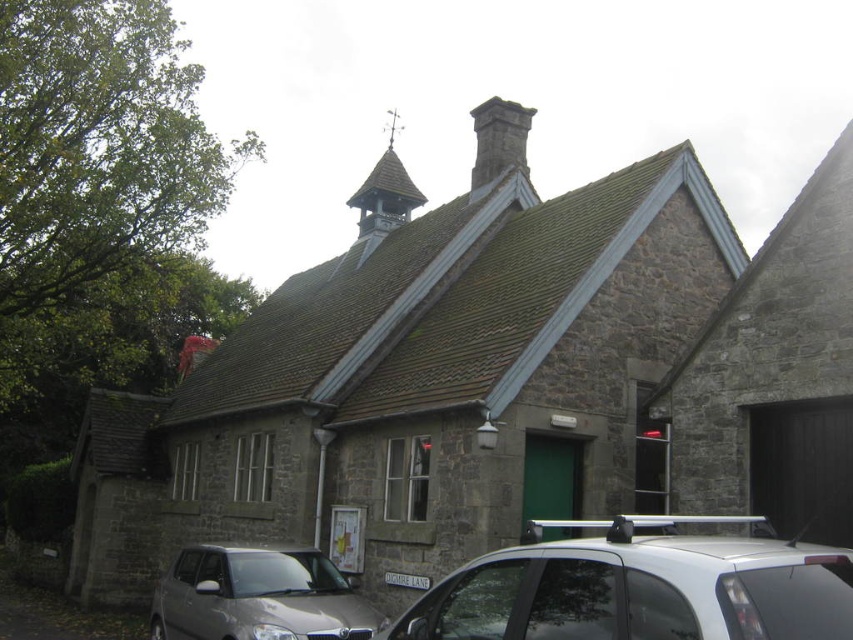
Question: Which object is farther from the camera taking this photo?

Choices:
 (A) silver metallic car at lower right
 (B) satin silver car at lower left

Answer: (B)

Question: Is silver metallic car at lower right above wooden spire at upper center?

Choices:
 (A) yes
 (B) no

Answer: (B)

Question: Is wooden spire at upper center below dark gray stone chimney at upper center?

Choices:
 (A) yes
 (B) no

Answer: (B)

Question: Which object is closer to the camera taking this photo?

Choices:
 (A) wooden spire at upper center
 (B) dark gray stone chimney at upper center
 (C) satin silver car at lower left
 (D) silver metallic car at lower right

Answer: (D)

Question: Observing the image, what is the correct spatial positioning of satin silver car at lower left in reference to dark gray stone chimney at upper center?

Choices:
 (A) above
 (B) below

Answer: (B)

Question: Which of these objects is positioned closest to the satin silver car at lower left?

Choices:
 (A) wooden spire at upper center
 (B) silver metallic car at lower right
 (C) dark gray stone chimney at upper center

Answer: (B)